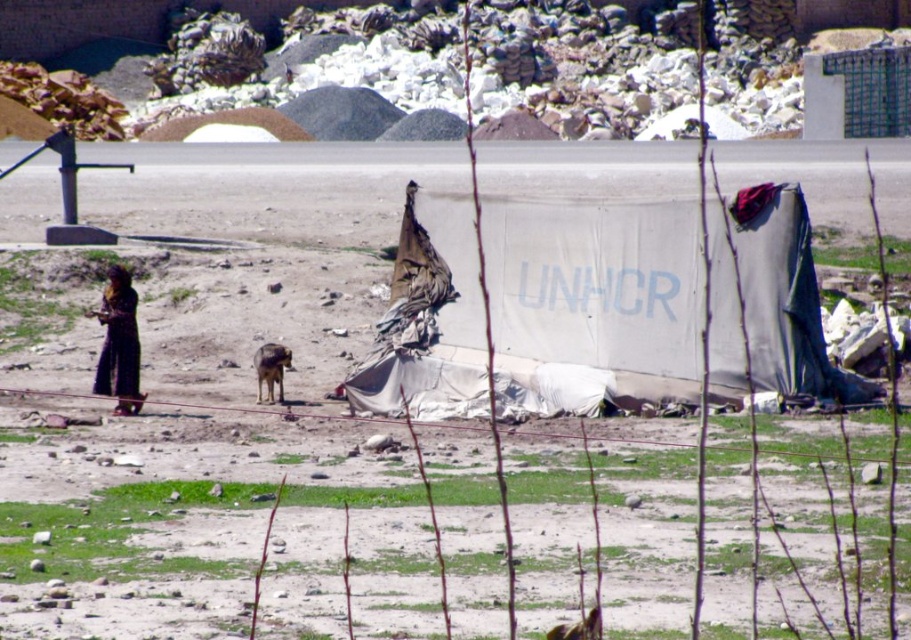
Question: Can you confirm if white tarp at center is positioned below black fabric at left?

Choices:
 (A) no
 (B) yes

Answer: (A)

Question: Among these points, which one is farthest from the camera?

Choices:
 (A) (672, 358)
 (B) (124, 280)

Answer: (B)

Question: Which of the following is the farthest from the observer?

Choices:
 (A) (417, 200)
 (B) (123, 358)

Answer: (A)

Question: Does white tarp at center appear on the left side of black fabric at left?

Choices:
 (A) yes
 (B) no

Answer: (B)

Question: Does white tarp at center appear on the left side of black fabric at left?

Choices:
 (A) yes
 (B) no

Answer: (B)